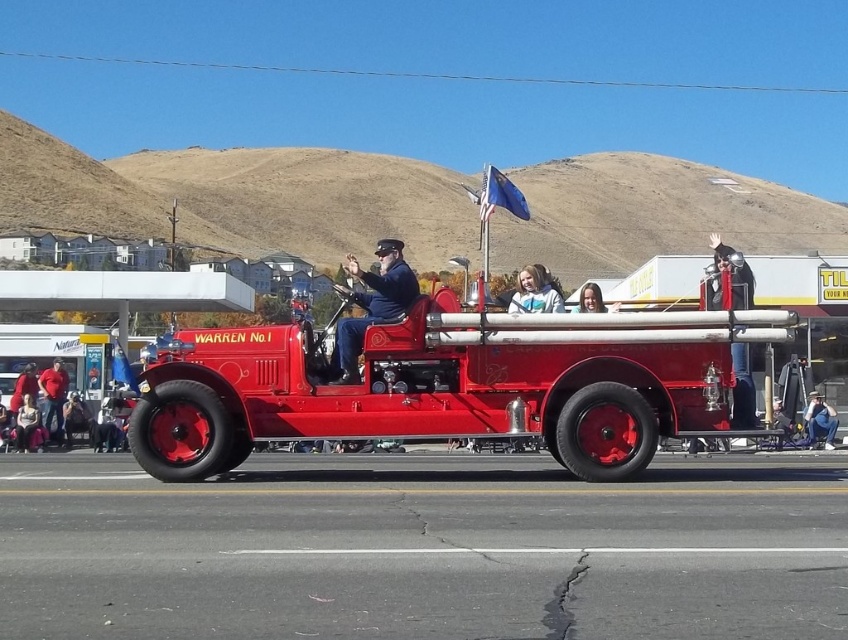
Question: Among these objects, which one is farthest from the camera?

Choices:
 (A) matte black uniform at center
 (B) white fleece jacket at center
 (C) red cotton shirt at center
 (D) denim pants at lower right

Answer: (C)

Question: Is the position of white fleece jacket at center less distant than that of smooth skin face at center?

Choices:
 (A) yes
 (B) no

Answer: (A)

Question: Can you confirm if shiny red fire truck at center is bigger than red cotton shirt at center?

Choices:
 (A) yes
 (B) no

Answer: (B)

Question: Considering the relative positions of white fleece jacket at center and blue fabric flag at upper center in the image provided, where is white fleece jacket at center located with respect to blue fabric flag at upper center?

Choices:
 (A) right
 (B) left

Answer: (A)

Question: Based on their relative distances, which object is nearer to the denim pants at lower right?

Choices:
 (A) white fleece jacket at center
 (B) shiny red fire truck at center
 (C) smooth skin face at center

Answer: (C)

Question: Which of the following is the closest to the observer?

Choices:
 (A) blue fabric flag at upper center
 (B) denim pants at lower right
 (C) smooth skin face at center

Answer: (C)